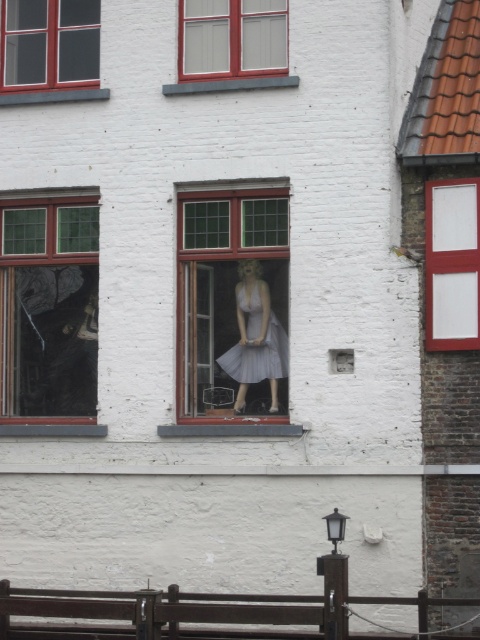
Question: Which object is the farthest from the white glass window at upper right?

Choices:
 (A) smooth concrete window sill at center
 (B) matte glass mannequin at center
 (C) matte red window at upper left
 (D) transparent glass mannequin at left

Answer: (C)

Question: Is white glass window at upper right positioned before matte red window at upper left?

Choices:
 (A) no
 (B) yes

Answer: (B)

Question: Is transparent glass mannequin at left bigger than satin gray dress at center?

Choices:
 (A) no
 (B) yes

Answer: (B)

Question: Where is white glass window at upper right located in relation to smooth concrete window sill at center in the image?

Choices:
 (A) right
 (B) left

Answer: (A)

Question: Estimate the real-world distances between objects in this image. Which object is closer to the matte red window at upper left?

Choices:
 (A) smooth concrete window sill at center
 (B) satin gray dress at center

Answer: (B)

Question: Which object is the closest to the matte glass mannequin at center?

Choices:
 (A) transparent glass mannequin at left
 (B) satin gray dress at center
 (C) smooth concrete window sill at center
 (D) matte red window at upper left

Answer: (B)